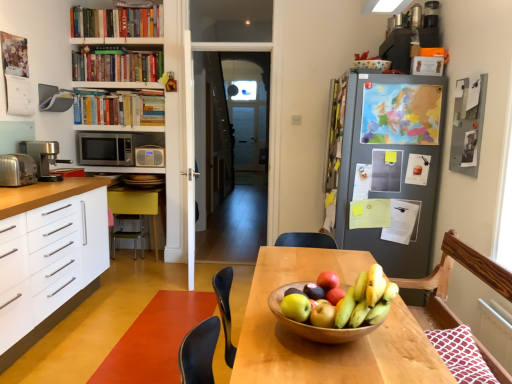
Question: Is point (106, 8) closer or farther from the camera than point (157, 72)?

Choices:
 (A) closer
 (B) farther

Answer: (A)

Question: Would you say hardcover books at upper center, placed as the first book when sorted from top to bottom, is inside or outside hardcover books at upper left, positioned as the second book in top-to-bottom order?

Choices:
 (A) outside
 (B) inside

Answer: (A)

Question: Based on their relative distances, which object is nearer to the green matte apple at center, the 4th apple in the back-to-front sequence?

Choices:
 (A) silver metallic radio at center, acting as the second appliance starting from the bottom
 (B) hardcover books at upper left, which is the 2th book in bottom-to-top order
 (C) satin silver coffee machine at left
 (D) hardcover books at upper center, arranged as the third book when ordered from the bottom
 (E) wooden chair at right, arranged as the third chair when viewed from the back

Answer: (E)

Question: Which of these objects is positioned closest to the silver metallic radio at center, arranged as the 2th appliance when viewed from the left?

Choices:
 (A) wooden chair at right, positioned as the 1th chair in right-to-left order
 (B) green matte apple at center, which is the 2th apple in front-to-back order
 (C) satin silver microwave at left
 (D) rubberized vinyl floor at lower center
 (E) wooden bowl of fruit at center

Answer: (C)